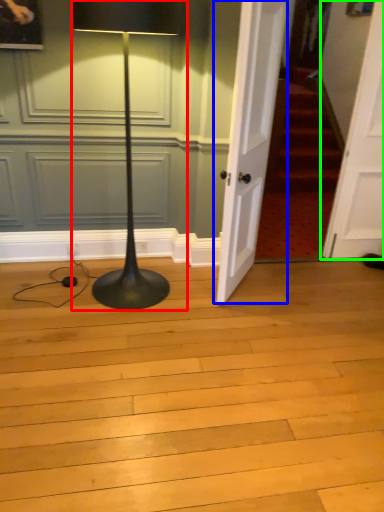
Question: Estimate the real-world distances between objects in this image. Which object is farther from lamp (highlighted by a red box), door (highlighted by a blue box) or door (highlighted by a green box)?

Choices:
 (A) door
 (B) door

Answer: (B)